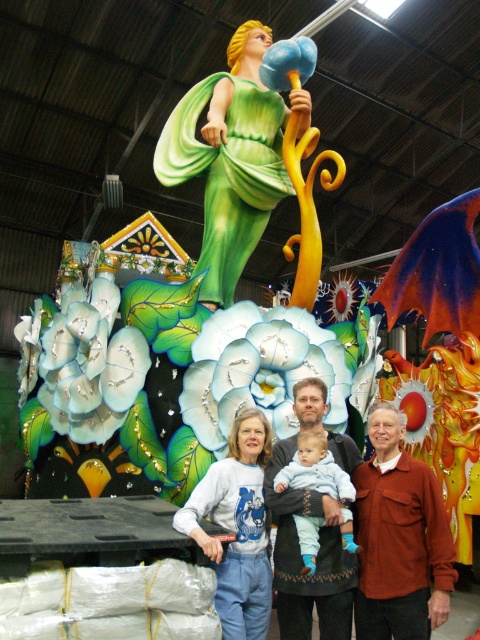
Is point (308, 396) positioned before point (264, 627)?

No, it is behind (264, 627).

Locate an element on the screen. The image size is (480, 640). dark brown leather jacket at center is located at coordinates (316, 557).

The width and height of the screenshot is (480, 640). Identify the location of dark brown leather jacket at center. (316, 557).

Can you confirm if smooth green dress at center is shorter than white matte sweatshirt at center?

No, smooth green dress at center is not shorter than white matte sweatshirt at center.

Who is more distant from viewer, (237, 131) or (192, 520)?

The point (237, 131) is behind.

Find the location of `smooth green dress at center`. smooth green dress at center is located at coordinates (228, 160).

Consider the image. Can you confirm if white matte sweatshirt at center is shorter than light blue fleece at center?

Incorrect, white matte sweatshirt at center's height does not fall short of light blue fleece at center's.

Who is lower down, white matte sweatshirt at center or light blue fleece at center?

Positioned lower is white matte sweatshirt at center.

Is point (264, 460) closer to camera compared to point (323, 474)?

No, it is not.

This screenshot has width=480, height=640. I want to click on white matte sweatshirt at center, so click(x=237, y=528).